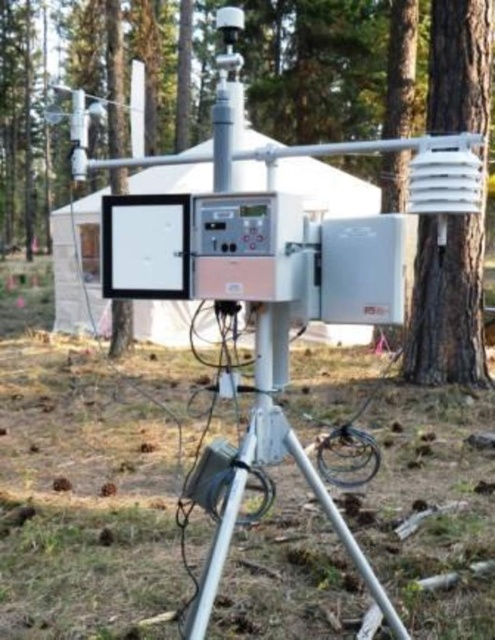
Question: Which point appears farthest from the camera in this image?

Choices:
 (A) (259, 339)
 (B) (453, 8)

Answer: (B)

Question: Is white plastic sensor at right below silver metallic tripod at lower center?

Choices:
 (A) yes
 (B) no

Answer: (B)

Question: Is matte white tree at center thinner than silver metallic tripod at lower center?

Choices:
 (A) yes
 (B) no

Answer: (B)

Question: Does matte white tree at center come in front of white plastic tent at center?

Choices:
 (A) yes
 (B) no

Answer: (A)

Question: Which point is farther from the camera taking this photo?

Choices:
 (A) (93, 296)
 (B) (298, 445)

Answer: (A)

Question: Based on their relative distances, which object is farther from the matte white tree at center?

Choices:
 (A) white plastic sensor at right
 (B) white plastic tent at center
 (C) silver metallic tripod at lower center

Answer: (C)